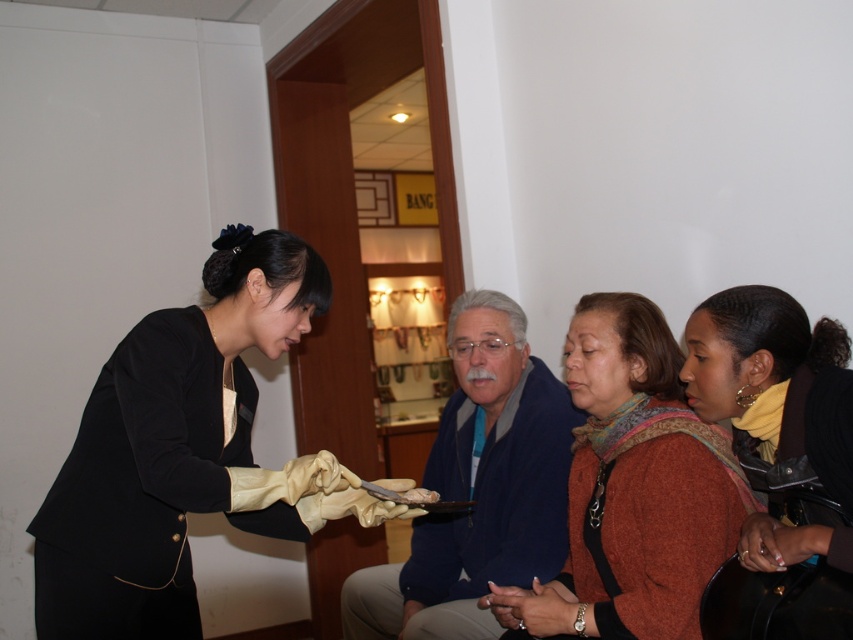
What is the exact coordinate of the blue fabric jacket at center?

The blue fabric jacket at center is located at point (x=479, y=486).

You are a customer in a jewelry store. You have a blue fabric jacket at center and a brown crumbly bread at center on the table. You want to place a small necklace between them. Can you fit it there?

The blue fabric jacket at center and brown crumbly bread at center are 17.68 inches apart, so there is enough space to place the small necklace between them.